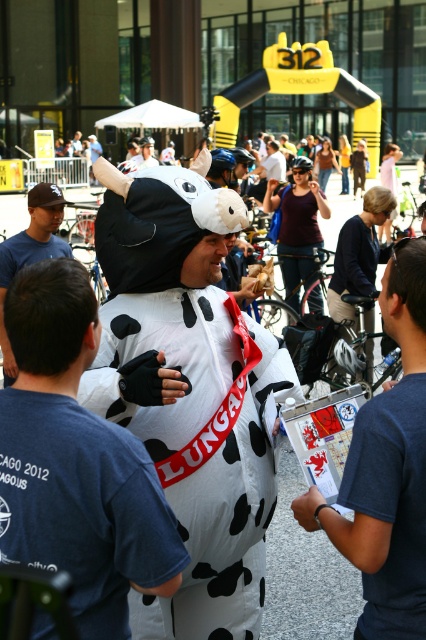
Based on the photo, is white matte cow at center below white plush cow at center?

Correct, white matte cow at center is located below white plush cow at center.

Which of these two, white matte cow at center or white plush cow at center, stands taller?

With more height is white plush cow at center.

This screenshot has height=640, width=426. Describe the element at coordinates (75, 461) in the screenshot. I see `white matte cow at center` at that location.

In order to click on white matte cow at center in this screenshot , I will do `click(75, 461)`.

Who is positioned more to the left, white paper map at center or white plush cow at center?

white plush cow at center

Does white paper map at center appear over white plush cow at center?

Actually, white paper map at center is below white plush cow at center.

Image resolution: width=426 pixels, height=640 pixels. What do you see at coordinates (386, 470) in the screenshot?
I see `white paper map at center` at bounding box center [386, 470].

Find the location of a particular element. The width and height of the screenshot is (426, 640). white paper map at center is located at coordinates (386, 470).

Does white matte cow at center come behind white paper map at center?

No, it is in front of white paper map at center.

Describe the element at coordinates (75, 461) in the screenshot. The height and width of the screenshot is (640, 426). I see `white matte cow at center` at that location.

You are a GUI agent. You are given a task and a screenshot of the screen. Output one action in this format:
    pyautogui.click(x=<x>, y=<y>)
    Task: Click on the white matte cow at center
    
    Given the screenshot: What is the action you would take?
    pyautogui.click(x=75, y=461)